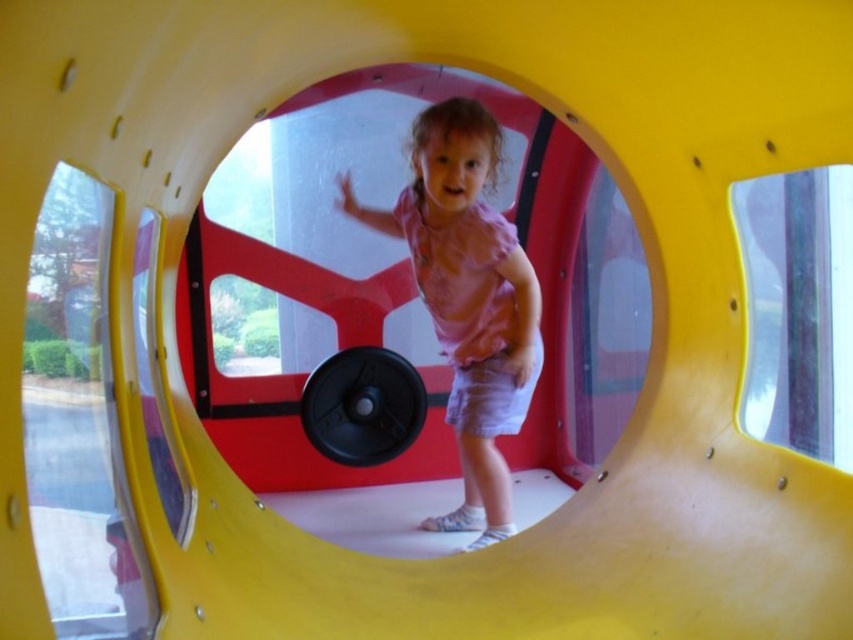
How distant is pink fabric dress at center from black rubber barbell at center?

A distance of 17.23 inches exists between pink fabric dress at center and black rubber barbell at center.

Does pink fabric dress at center appear on the left side of black rubber barbell at center?

No, pink fabric dress at center is not to the left of black rubber barbell at center.

Describe the element at coordinates (468, 298) in the screenshot. I see `pink fabric dress at center` at that location.

At what (x,y) coordinates should I click in order to perform the action: click on pink fabric dress at center. Please return your answer as a coordinate pair (x, y). This screenshot has height=640, width=853. Looking at the image, I should click on (468, 298).